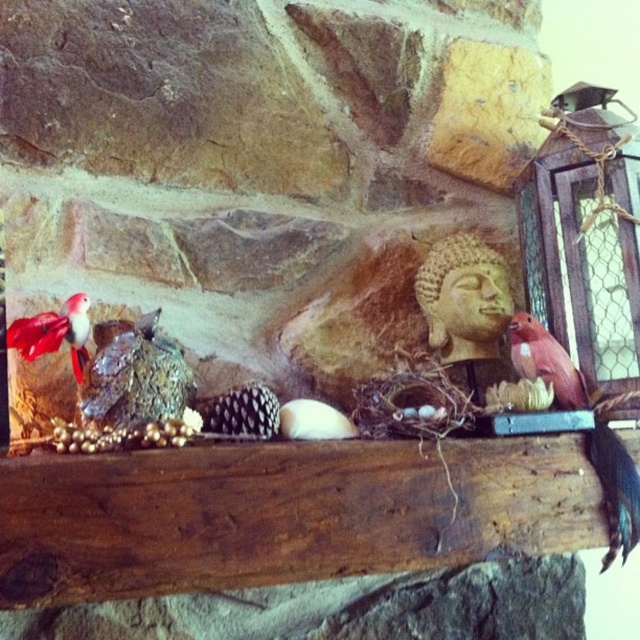
What do you see at coordinates (616, 488) in the screenshot? The width and height of the screenshot is (640, 640). I see `matte pink parrot at right` at bounding box center [616, 488].

Who is taller, matte pink parrot at right or matte pink bird at right?

Standing taller between the two is matte pink parrot at right.

Does point (616, 502) lie behind point (538, 339)?

No, it is in front of (538, 339).

The height and width of the screenshot is (640, 640). I want to click on matte pink parrot at right, so click(x=616, y=488).

Who is lower down, matte pink bird at right or matte red bird at left?

matte pink bird at right

I want to click on matte pink bird at right, so click(x=545, y=360).

Where is `matte pink bird at right`? This screenshot has height=640, width=640. matte pink bird at right is located at coordinates (545, 360).

Is matte pink parrot at right wider than matte red bird at left?

Yes, matte pink parrot at right is wider than matte red bird at left.

Does matte pink parrot at right have a lesser width compared to matte red bird at left?

No.

Is point (545, 333) farther from camera compared to point (42, 323)?

Yes.

This screenshot has width=640, height=640. I want to click on matte pink parrot at right, so click(616, 488).